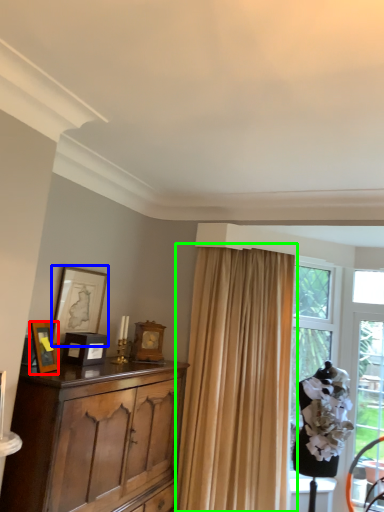
Question: Which is farther away from picture frame (highlighted by a red box)? picture frame (highlighted by a blue box) or curtain (highlighted by a green box)?

Choices:
 (A) picture frame
 (B) curtain

Answer: (B)